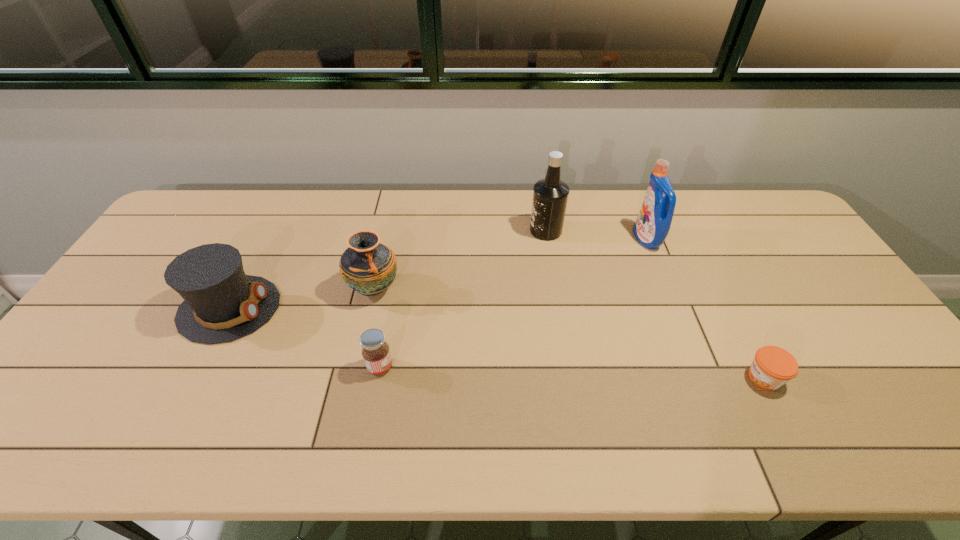
This screenshot has height=540, width=960. In order to click on blank space located on the front label of the rightmost object in this screenshot , I will do `click(656, 377)`.

This screenshot has height=540, width=960. Find the location of `liquor that is at the far edge`. liquor that is at the far edge is located at coordinates (550, 195).

The image size is (960, 540). Find the location of `detergent that is at the far edge`. detergent that is at the far edge is located at coordinates (653, 223).

Image resolution: width=960 pixels, height=540 pixels. In the image, there is a desktop. In order to click on blank space at the far edge in this screenshot , I will do `click(567, 204)`.

Image resolution: width=960 pixels, height=540 pixels. Find the location of `vacant region at the near edge`. vacant region at the near edge is located at coordinates (x=119, y=428).

Where is `vacant space at the left edge of the desktop`? This screenshot has height=540, width=960. vacant space at the left edge of the desktop is located at coordinates (117, 298).

In the image, there is a desktop. In order to click on vacant space at the right edge in this screenshot , I will do click(x=817, y=279).

This screenshot has height=540, width=960. In order to click on vacant space that's between the pottery and the fourth object from left to right in this screenshot , I will do `click(460, 260)`.

You are a GUI agent. You are given a task and a screenshot of the screen. Output one action in this format:
    pyautogui.click(x=<x>, y=<y>)
    Task: Click on the vacant area between the pottery and the detergent
    This screenshot has width=960, height=540.
    Given the screenshot: What is the action you would take?
    pyautogui.click(x=511, y=264)

Find the location of `unoccupied position between the left jam and the leftmost object`. unoccupied position between the left jam and the leftmost object is located at coordinates (305, 338).